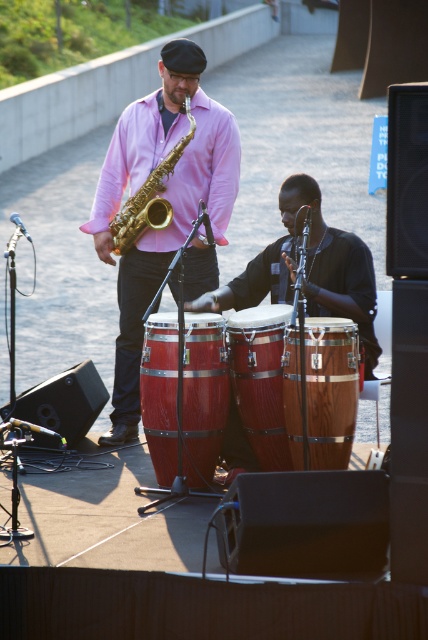
Question: From the image, what is the correct spatial relationship of matte gold saxophone at center in relation to wooden drum at center?

Choices:
 (A) left
 (B) right

Answer: (A)

Question: Considering the real-world distances, which object is farthest from the shiny wood drum at center?

Choices:
 (A) wooden drum at center
 (B) wooden conga drums at center

Answer: (A)

Question: Which point is closer to the camera taking this photo?

Choices:
 (A) (163, 464)
 (B) (151, 172)
 (C) (345, 321)

Answer: (C)

Question: Is shiny wood drum at center smaller than wooden conga drums at center?

Choices:
 (A) no
 (B) yes

Answer: (A)

Question: Is matte gold saxophone at center below shiny wood drum at center?

Choices:
 (A) no
 (B) yes

Answer: (A)

Question: Which of these objects is positioned closest to the wooden conga drums at center?

Choices:
 (A) shiny wood drum at center
 (B) gold shiny trumpet at center

Answer: (A)